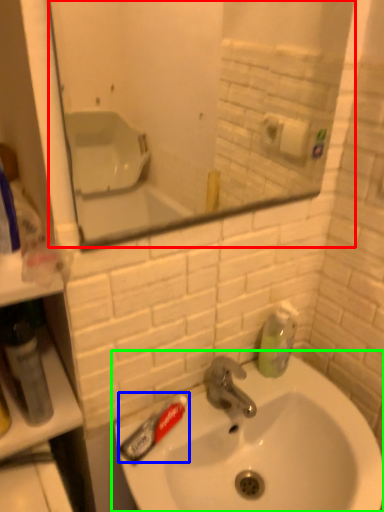
Question: Considering the real-world distances, which object is closest to mirror (highlighted by a red box)? toothpaste (highlighted by a blue box) or sink (highlighted by a green box).

Choices:
 (A) toothpaste
 (B) sink

Answer: (B)